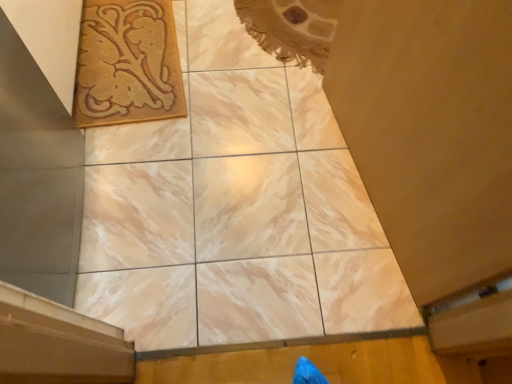
Question: Does marble tile at center appear on the right side of wooden at lower right?

Choices:
 (A) no
 (B) yes

Answer: (A)

Question: Is marble tile at center far from wooden at lower right?

Choices:
 (A) yes
 (B) no

Answer: (B)

Question: From a real-world perspective, is marble tile at center on wooden at lower right?

Choices:
 (A) no
 (B) yes

Answer: (A)

Question: Is marble tile at center not inside wooden at lower right?

Choices:
 (A) no
 (B) yes

Answer: (B)

Question: Is wooden at lower right at the back of marble tile at center?

Choices:
 (A) no
 (B) yes

Answer: (A)

Question: Considering the relative positions of marble tile at center and wooden at lower right in the image provided, is marble tile at center in front of wooden at lower right?

Choices:
 (A) no
 (B) yes

Answer: (A)

Question: From a real-world perspective, is beige woven rug at upper left on marble tile at center?

Choices:
 (A) yes
 (B) no

Answer: (A)

Question: Is the position of beige woven rug at upper left more distant than that of marble tile at center?

Choices:
 (A) no
 (B) yes

Answer: (B)

Question: Is beige woven rug at upper left positioned far away from marble tile at center?

Choices:
 (A) no
 (B) yes

Answer: (A)

Question: Can you confirm if beige woven rug at upper left is positioned to the right of marble tile at center?

Choices:
 (A) yes
 (B) no

Answer: (B)

Question: Is beige woven rug at upper left oriented towards marble tile at center?

Choices:
 (A) no
 (B) yes

Answer: (A)

Question: Can you confirm if beige woven rug at upper left is smaller than marble tile at center?

Choices:
 (A) no
 (B) yes

Answer: (A)

Question: From the image's perspective, would you say wooden at lower right is shown under beige woven rug at upper left?

Choices:
 (A) no
 (B) yes

Answer: (B)